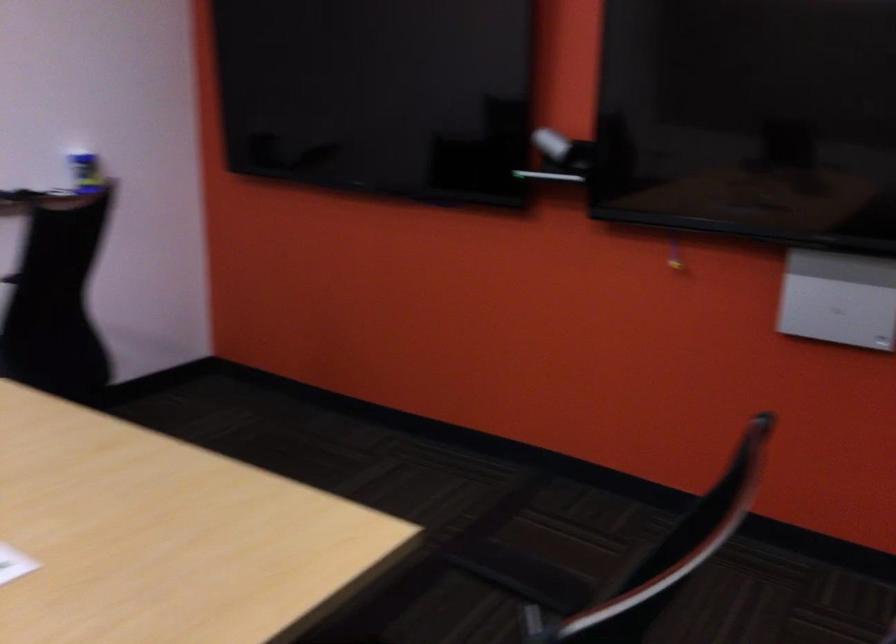
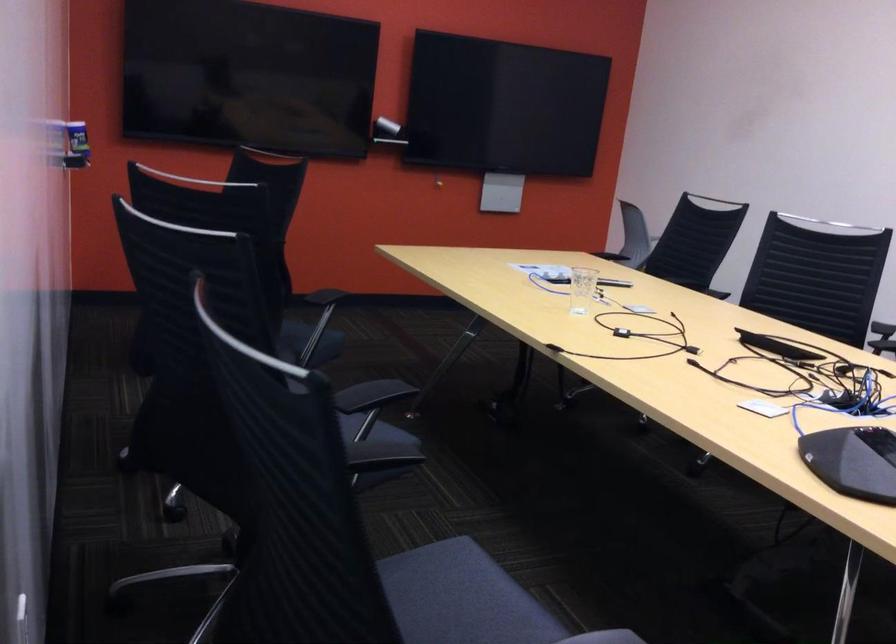
Find the pixel in the second image that matches (x=73, y=182) in the first image.

(76, 145)